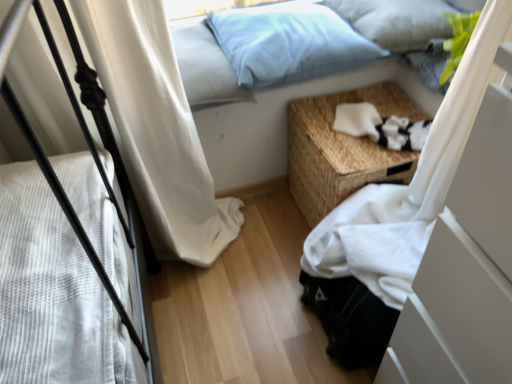
Question: In terms of width, does woven wood nightstand at lower right look wider or thinner when compared to light blue fabric pillow at upper center, which is the 2th pillow in left-to-right order?

Choices:
 (A) thin
 (B) wide

Answer: (A)

Question: From their relative heights in the image, would you say woven wood nightstand at lower right is taller or shorter than light blue fabric pillow at upper center, placed as the second pillow when sorted from right to left?

Choices:
 (A) short
 (B) tall

Answer: (B)

Question: Which is farther from the white fabric at lower right?

Choices:
 (A) woven wood nightstand at lower right
 (B) light blue fabric pillow at upper center, which is the 2th pillow in left-to-right order
 (C) light blue fabric pillow at upper center, the third pillow in the left-to-right sequence
 (D) light blue fabric pillow at upper center, marked as the third pillow in a right-to-left arrangement
 (E) white soft fabric at lower right

Answer: (C)

Question: Considering the real-world distances, which object is farthest from the white soft fabric at lower right?

Choices:
 (A) white fabric at lower right
 (B) light blue fabric pillow at upper center, placed as the second pillow when sorted from right to left
 (C) woven wood nightstand at lower right
 (D) light blue fabric pillow at upper center, which is the first pillow from left to right
 (E) light blue fabric pillow at upper center, the 1th pillow viewed from the right

Answer: (A)